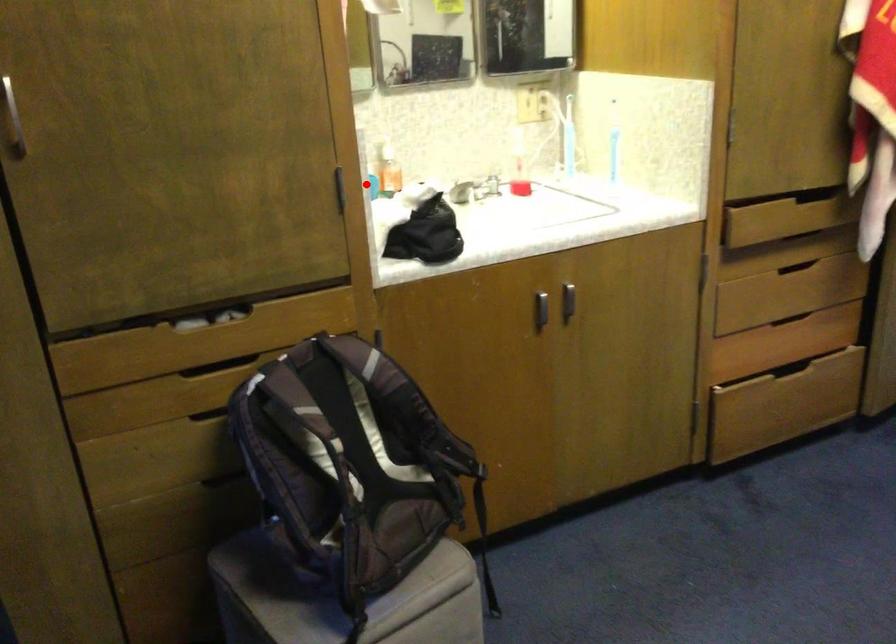
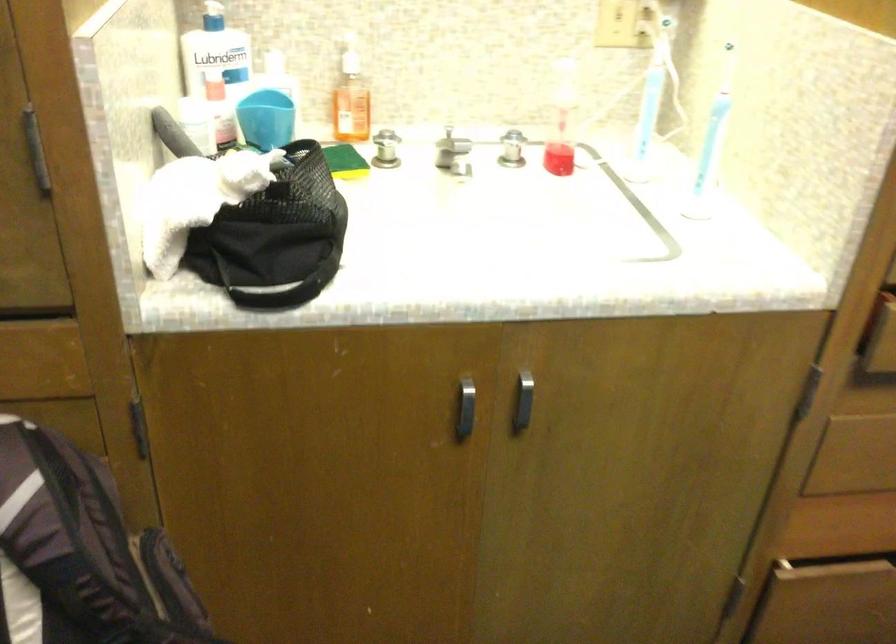
Question: A red point is marked in image1. In image2, is the corresponding 3D point closer to the camera or farther? Reply with the corresponding letter.

Choices:
 (A) The corresponding 3D point is closer.
 (B) The corresponding 3D point is farther.

Answer: (A)